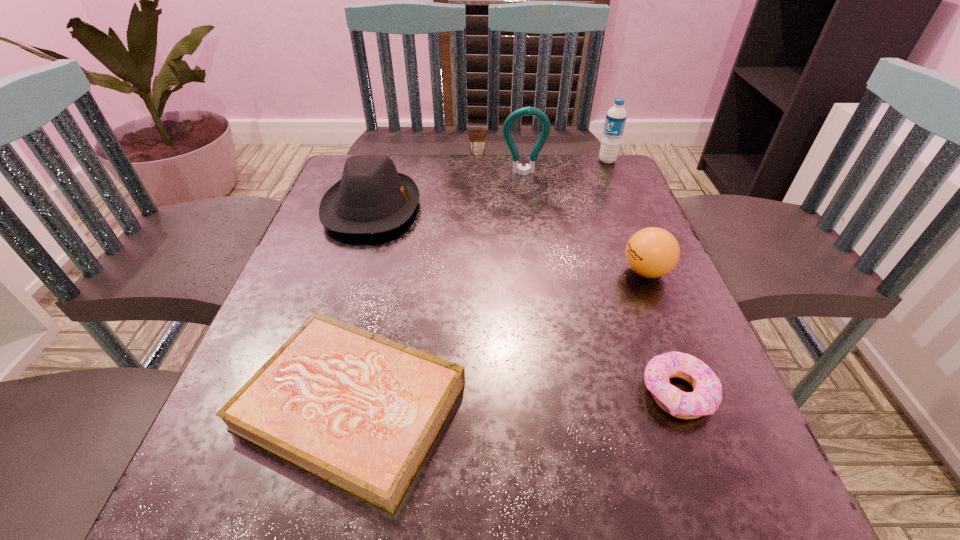
What are the coordinates of `free spot between the hardback book and the bottle opener` in the screenshot? It's located at (438, 289).

Find the location of a particular element. The width and height of the screenshot is (960, 540). free spot between the water bottle and the bottle opener is located at coordinates (565, 167).

The image size is (960, 540). I want to click on vacant region between the fourth farthest object and the doughnut, so click(x=661, y=332).

Point out which object is positioned as the second nearest to the farthest object. Please provide its 2D coordinates. Your answer should be formatted as a tuple, i.e. [(x, y)], where the tuple contains the x and y coordinates of a point satisfying the conditions above.

[(652, 252)]

Where is `object identified as the closest to the fourth farthest object`? object identified as the closest to the fourth farthest object is located at coordinates (707, 391).

Locate an element on the screen. free spot that satisfies the following two spatial constraints: 1. at the jaws of the doughnut; 2. on the right side of the second farthest object is located at coordinates (555, 393).

At what (x,y) coordinates should I click in order to perform the action: click on blank space that satisfies the following two spatial constraints: 1. on the label of the water bottle; 2. at the jaws of the third object from left to right. Please return your answer as a coordinate pair (x, y). Image resolution: width=960 pixels, height=540 pixels. Looking at the image, I should click on (612, 173).

Where is `free point that satisfies the following two spatial constraints: 1. at the jaws of the bottle opener; 2. on the right side of the doughnut`? free point that satisfies the following two spatial constraints: 1. at the jaws of the bottle opener; 2. on the right side of the doughnut is located at coordinates click(555, 393).